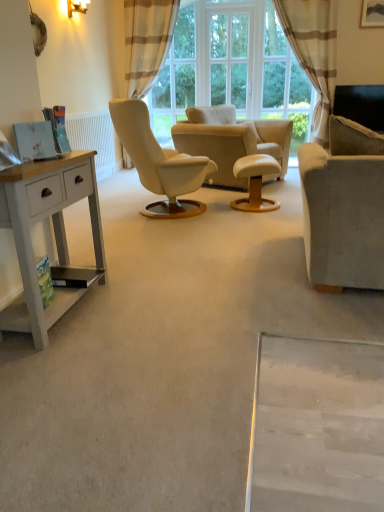
Question: Can you confirm if beige striped curtain at upper center is bigger than light gray fabric couch at right?

Choices:
 (A) yes
 (B) no

Answer: (B)

Question: Does beige striped curtain at upper center have a smaller size compared to light gray fabric couch at right?

Choices:
 (A) yes
 (B) no

Answer: (A)

Question: Is the surface of beige striped curtain at upper center in direct contact with light gray fabric couch at right?

Choices:
 (A) no
 (B) yes

Answer: (A)

Question: Can you confirm if beige striped curtain at upper center is wider than light gray fabric couch at right?

Choices:
 (A) no
 (B) yes

Answer: (A)

Question: Is beige striped curtain at upper center shorter than light gray fabric couch at right?

Choices:
 (A) no
 (B) yes

Answer: (A)

Question: Is beige striped curtain at upper center positioned before light gray fabric couch at right?

Choices:
 (A) yes
 (B) no

Answer: (B)

Question: Is white painted radiator at left thinner than matte gold wall sconce at upper left?

Choices:
 (A) yes
 (B) no

Answer: (A)

Question: Can you confirm if white painted radiator at left is wider than matte gold wall sconce at upper left?

Choices:
 (A) yes
 (B) no

Answer: (B)

Question: Does white painted radiator at left appear on the left side of matte gold wall sconce at upper left?

Choices:
 (A) yes
 (B) no

Answer: (B)

Question: From a real-world perspective, is white painted radiator at left below matte gold wall sconce at upper left?

Choices:
 (A) no
 (B) yes

Answer: (B)

Question: Is white painted radiator at left outside matte gold wall sconce at upper left?

Choices:
 (A) no
 (B) yes

Answer: (B)

Question: Is white painted radiator at left oriented away from matte gold wall sconce at upper left?

Choices:
 (A) no
 (B) yes

Answer: (A)

Question: Is light gray fabric couch at right positioned beyond the bounds of white painted radiator at left?

Choices:
 (A) no
 (B) yes

Answer: (B)